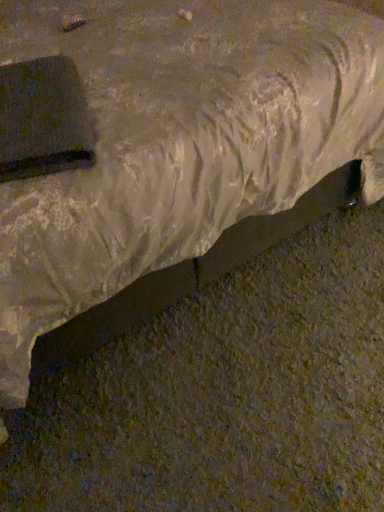
This screenshot has width=384, height=512. What do you see at coordinates (43, 119) in the screenshot? I see `matte black pad at left` at bounding box center [43, 119].

What is the approximate width of matte black pad at left?

matte black pad at left is 15.72 inches wide.

Image resolution: width=384 pixels, height=512 pixels. What are the coordinates of `matte black pad at left` in the screenshot? It's located at (43, 119).

At what (x,y) coordinates should I click in order to perform the action: click on matte black pad at left. Please return your answer as a coordinate pair (x, y). This screenshot has width=384, height=512. Looking at the image, I should click on (43, 119).